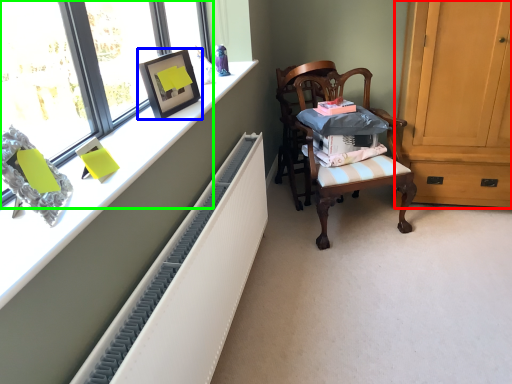
Question: Estimate the real-world distances between objects in this image. Which object is farther from cabinetry (highlighted by a red box), picture frame (highlighted by a blue box) or window (highlighted by a green box)?

Choices:
 (A) picture frame
 (B) window

Answer: (B)